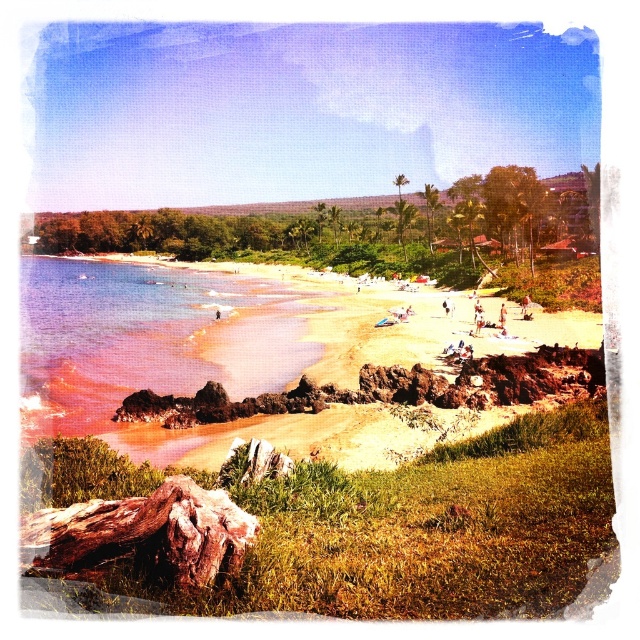
You are planning to build a sandcastle on the beach. Which area would you choose between the smooth sand beach at center and the pink sand at beach left to ensure it stays stable longer?

The pink sand at beach left is taller than the smooth sand beach at center, so it might have more compacted sand, making it better for a stable sandcastle.

You are a lifeguard standing on the beach and need to reach both the smooth sand beach at center and the pink sand at beach left to check for swimmers. How far apart are these two areas?

The smooth sand beach at center and the pink sand at beach left are 2.77 meters apart from each other.